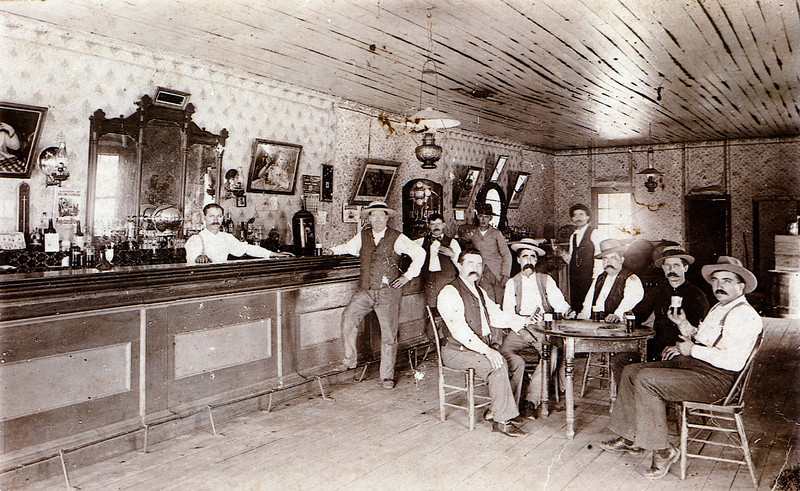
The width and height of the screenshot is (800, 491). What are the coordinates of `hung pictures` in the screenshot? It's located at (522, 189), (494, 172), (472, 182), (382, 180), (268, 174), (10, 133).